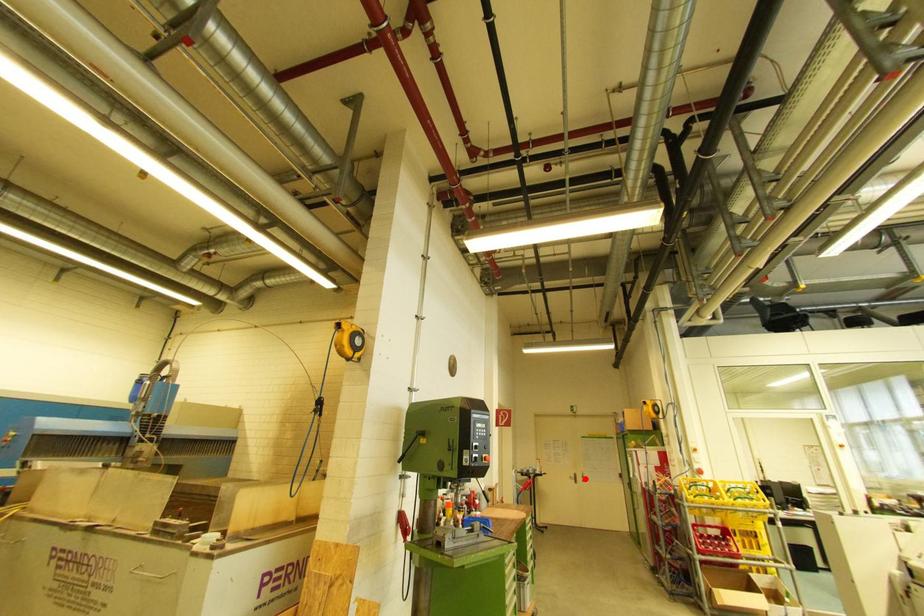
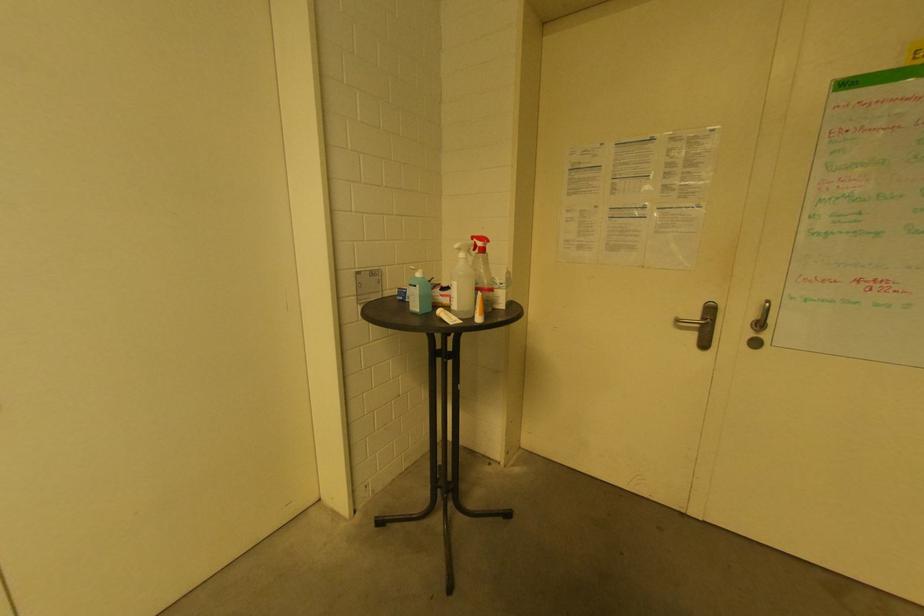
Question: A red point is marked in image1. In image2, is the corresponding 3D point closer to the camera or farther? Reply with the corresponding letter.

Choices:
 (A) The corresponding 3D point is closer.
 (B) The corresponding 3D point is farther.

Answer: (A)